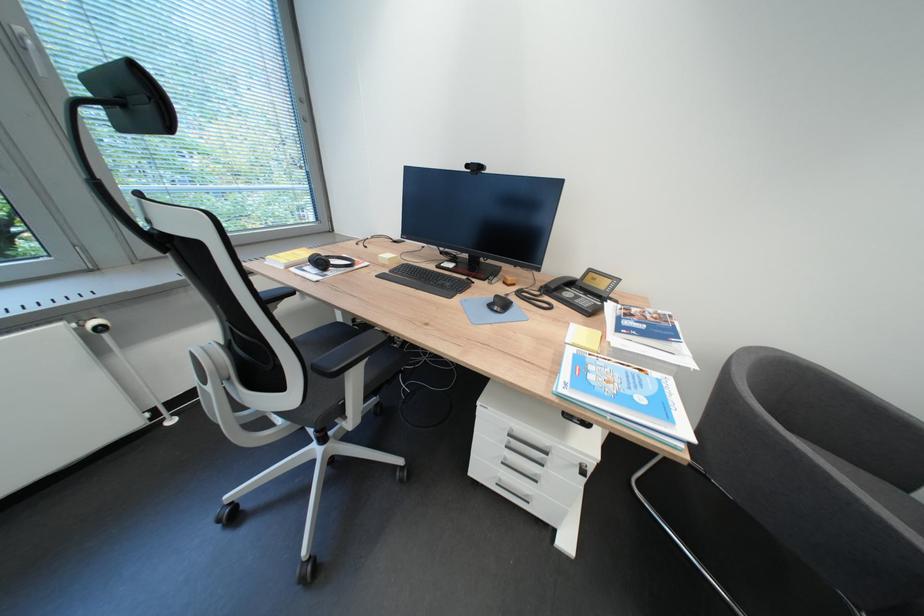
This screenshot has height=616, width=924. What do you see at coordinates (275, 296) in the screenshot?
I see `the black chair armrest` at bounding box center [275, 296].